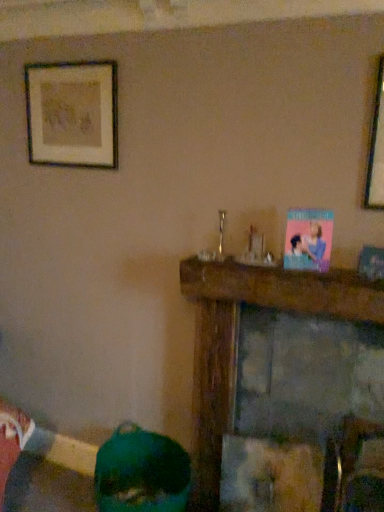
Question: From the image's perspective, is wooden framed artwork at upper left located beneath wooden mantel at center?

Choices:
 (A) no
 (B) yes

Answer: (A)

Question: Can you confirm if wooden framed artwork at upper left is positioned to the left of wooden mantel at center?

Choices:
 (A) no
 (B) yes

Answer: (B)

Question: Is wooden framed artwork at upper left facing towards wooden mantel at center?

Choices:
 (A) no
 (B) yes

Answer: (A)

Question: Considering the relative sizes of wooden framed artwork at upper left and wooden mantel at center in the image provided, is wooden framed artwork at upper left wider than wooden mantel at center?

Choices:
 (A) yes
 (B) no

Answer: (B)

Question: Does wooden framed artwork at upper left come in front of wooden mantel at center?

Choices:
 (A) yes
 (B) no

Answer: (B)

Question: Is wooden framed artwork at upper left next to wooden mantel at center and touching it?

Choices:
 (A) no
 (B) yes

Answer: (A)

Question: From the image's perspective, is green matte vase at lower left over wooden mantel at center?

Choices:
 (A) yes
 (B) no

Answer: (B)

Question: Considering the relative positions of green matte vase at lower left and wooden mantel at center in the image provided, is green matte vase at lower left behind wooden mantel at center?

Choices:
 (A) yes
 (B) no

Answer: (A)

Question: Considering the relative sizes of green matte vase at lower left and wooden mantel at center in the image provided, is green matte vase at lower left taller than wooden mantel at center?

Choices:
 (A) yes
 (B) no

Answer: (B)

Question: Does green matte vase at lower left turn towards wooden mantel at center?

Choices:
 (A) no
 (B) yes

Answer: (A)

Question: Is green matte vase at lower left to the right of wooden mantel at center from the viewer's perspective?

Choices:
 (A) yes
 (B) no

Answer: (B)

Question: Is green matte vase at lower left not close to wooden mantel at center?

Choices:
 (A) yes
 (B) no

Answer: (B)

Question: Does green matte vase at lower left have a greater width compared to wooden framed artwork at upper left?

Choices:
 (A) no
 (B) yes

Answer: (B)